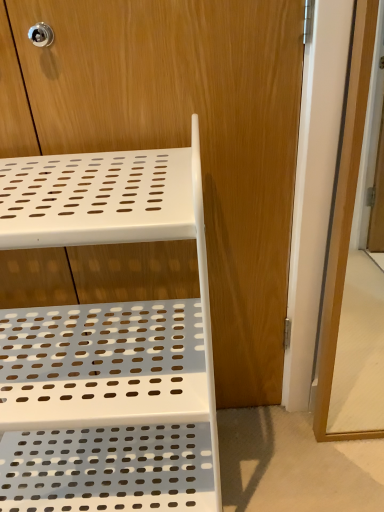
Question: From the image's perspective, relative to transparent glass screen door at right, is white plastic shelf at upper left above or below?

Choices:
 (A) above
 (B) below

Answer: (B)

Question: In terms of width, does white plastic shelf at upper left look wider or thinner when compared to transparent glass screen door at right?

Choices:
 (A) wide
 (B) thin

Answer: (A)

Question: Which of these objects is positioned farthest from the transparent glass screen door at right?

Choices:
 (A) white plastic shelf at center
 (B) white plastic shelf at upper left

Answer: (B)

Question: Which object is the farthest from the transparent glass screen door at right?

Choices:
 (A) white plastic shelf at upper left
 (B) white plastic shelf at center

Answer: (A)